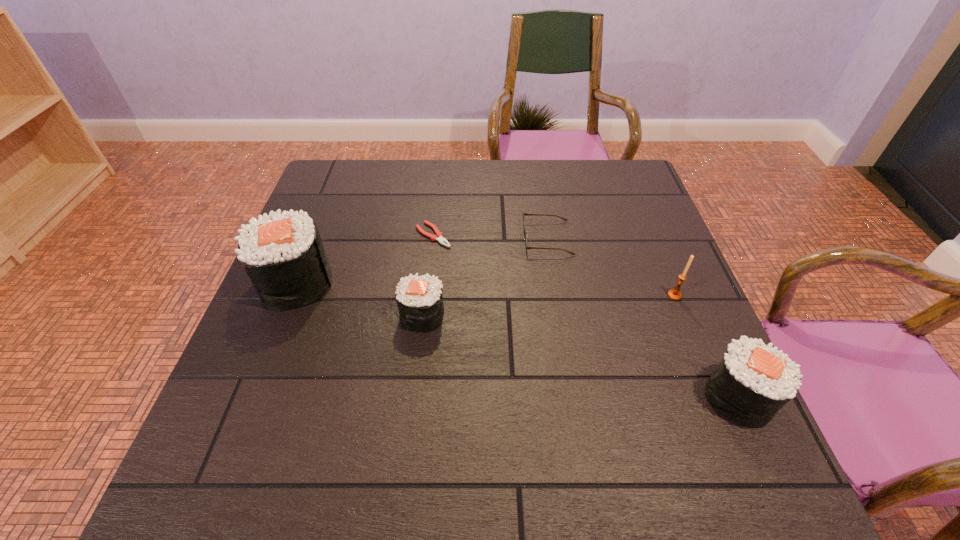
Image resolution: width=960 pixels, height=540 pixels. I want to click on the leftmost sushi, so click(x=283, y=255).

You are a GUI agent. You are given a task and a screenshot of the screen. Output one action in this format:
    pyautogui.click(x=<x>, y=<y>)
    Task: Click on the tallest sushi
    Image resolution: width=960 pixels, height=540 pixels.
    Given the screenshot: What is the action you would take?
    pyautogui.click(x=283, y=255)

Locate an element on the screen. The image size is (960, 540). the third shortest object is located at coordinates (419, 298).

Where is `the shortest sushi`? The image size is (960, 540). the shortest sushi is located at coordinates (419, 298).

This screenshot has height=540, width=960. What are the coordinates of `the second shortest sushi` in the screenshot? It's located at (753, 381).

The height and width of the screenshot is (540, 960). Identify the location of the nearest sushi. (753, 381).

Identify the location of the shortest object. The height and width of the screenshot is (540, 960). (439, 237).

Where is `candle_holder`? The height and width of the screenshot is (540, 960). candle_holder is located at coordinates (674, 294).

You are a GUI agent. You are given a task and a screenshot of the screen. Output one action in this format:
    pyautogui.click(x=<x>, y=<y>)
    Task: Click on the fourth object from left to right
    This screenshot has width=960, height=540.
    Given the screenshot: What is the action you would take?
    524,226

Locate an element on the screen. the second shortest object is located at coordinates (524, 226).